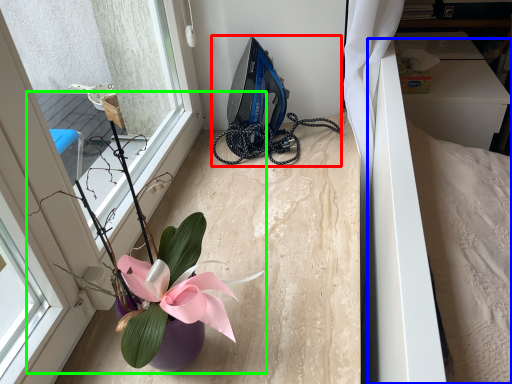
Question: Which object is the closest to the equipment (highlighted by a red box)? Choose among these: bed (highlighted by a blue box) or houseplant (highlighted by a green box).

Choices:
 (A) bed
 (B) houseplant

Answer: (A)